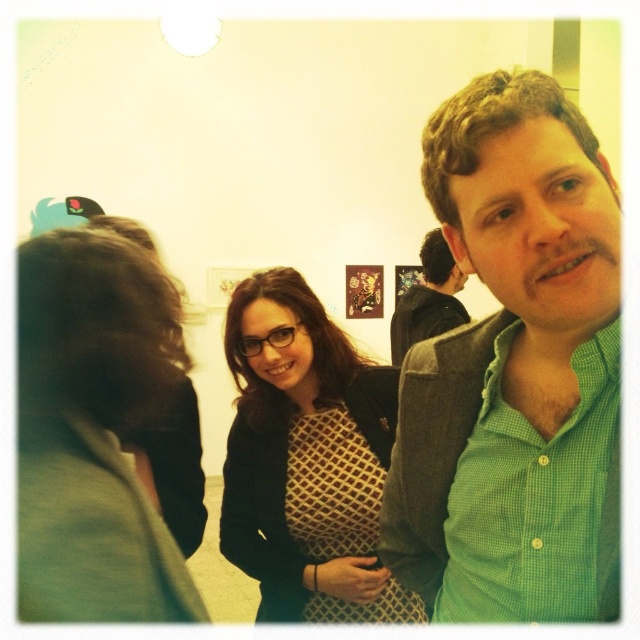
Question: Is dark brown hair at left in front of matte black blazer at center?

Choices:
 (A) yes
 (B) no

Answer: (A)

Question: Which of the following is the farthest from the observer?

Choices:
 (A) (429, 266)
 (B) (61, 401)
 (C) (317, 374)

Answer: (A)

Question: From the image, what is the correct spatial relationship of green checkered shirt at center in relation to matte black blazer at center?

Choices:
 (A) right
 (B) left

Answer: (A)

Question: Is green checkered shirt at center closer to camera compared to matte black blazer at center?

Choices:
 (A) no
 (B) yes

Answer: (B)

Question: Which object is closer to the camera taking this photo?

Choices:
 (A) matte black blazer at center
 (B) dark brown hair at left

Answer: (B)

Question: Which of the following is the farthest from the observer?

Choices:
 (A) (396, 339)
 (B) (51, 540)

Answer: (A)